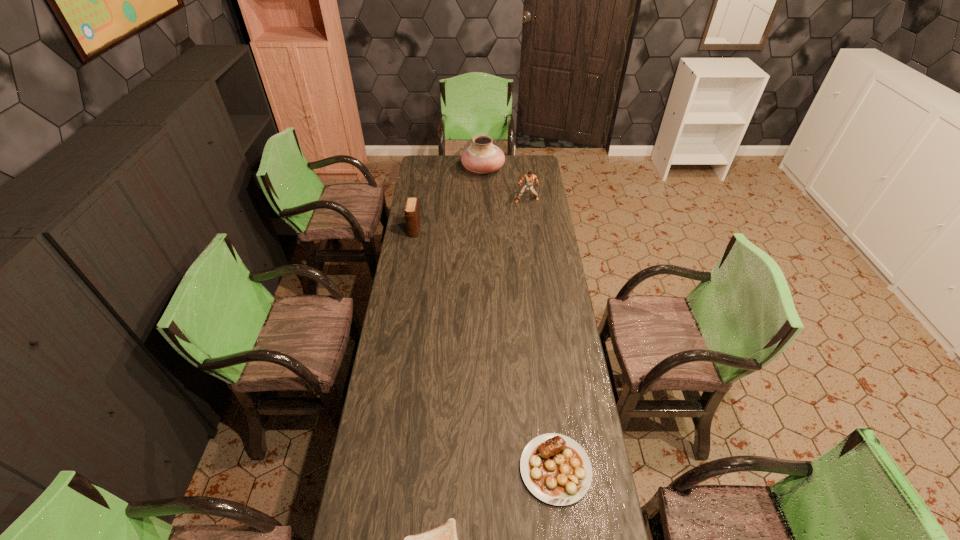
This screenshot has width=960, height=540. What are the coordinates of `pottery` in the screenshot? It's located at (482, 156).

Identify the location of the fourth nearest object. (529, 178).

Locate an element on the screen. the leftmost object is located at coordinates (412, 213).

Locate an element on the screen. The image size is (960, 540). diary is located at coordinates (412, 213).

Locate an element on the screen. The image size is (960, 540). the fourth tallest object is located at coordinates (556, 469).

The width and height of the screenshot is (960, 540). I want to click on the second nearest object, so click(556, 469).

Identify the location of vacant space located on the right of the farthest object. (524, 170).

Identify the location of vacant space located 0.190m on the front-facing side of the puncher. (530, 226).

Identify the location of vacant space located on the spine side of the third nearest object. (411, 253).

This screenshot has width=960, height=540. What are the coordinates of `vacant space located 0.070m on the front of the fourth tallest object` in the screenshot? It's located at (564, 533).